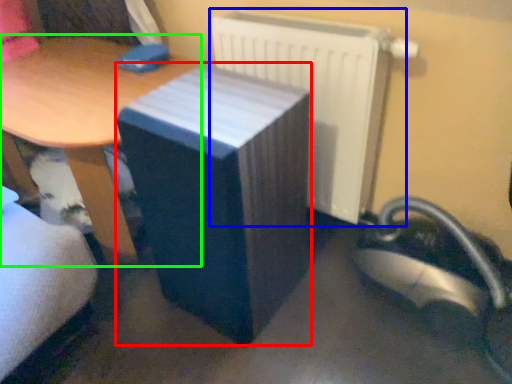
Question: Based on their relative distances, which object is farther from table (highlighted by a red box)? Choose from radiator (highlighted by a blue box) and table (highlighted by a green box).

Choices:
 (A) radiator
 (B) table

Answer: (B)